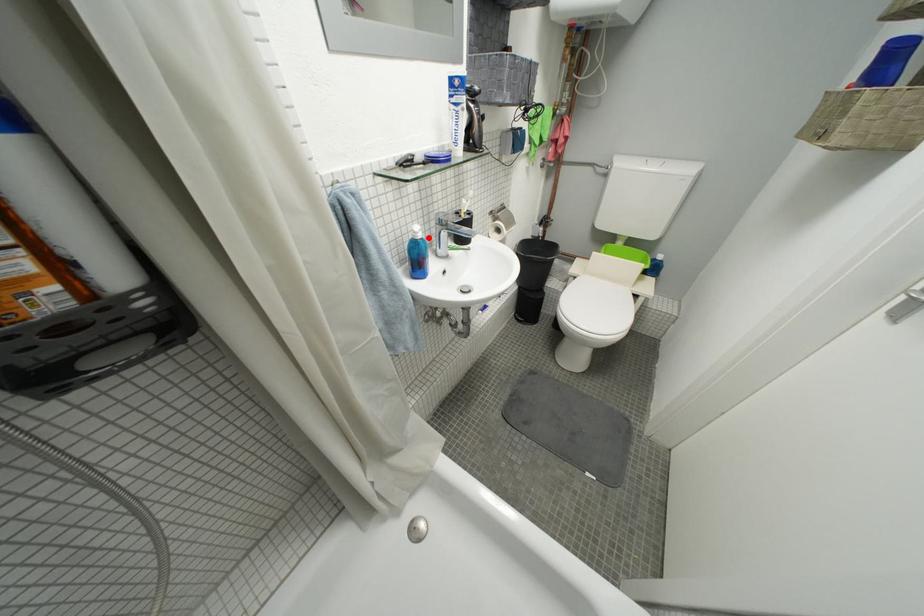
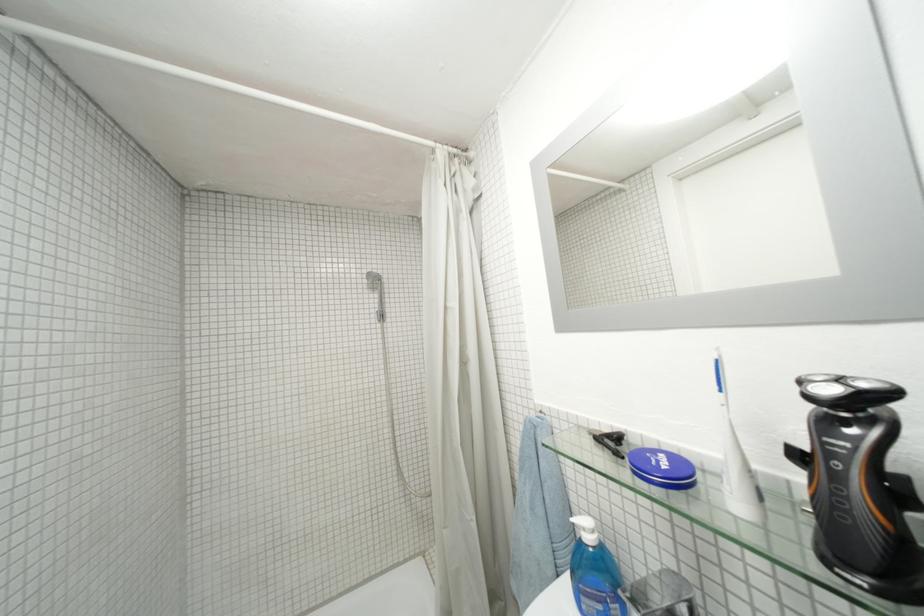
Question: I am providing you with two images of the same scene from different viewpoints. Given a red point in image1, look at the same physical point in image2. Is it:

Choices:
 (A) Closer to the viewpoint
 (B) Farther from the viewpoint

Answer: (B)